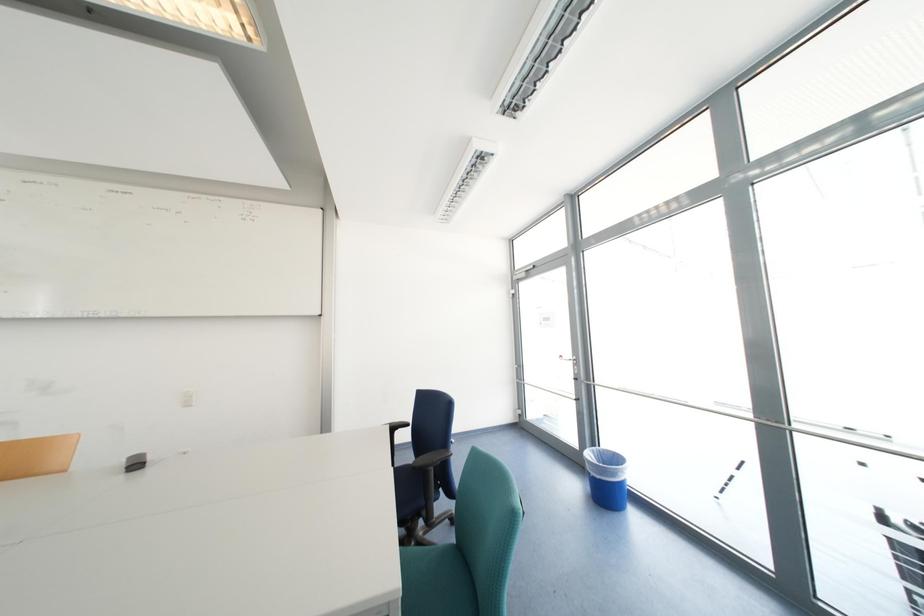
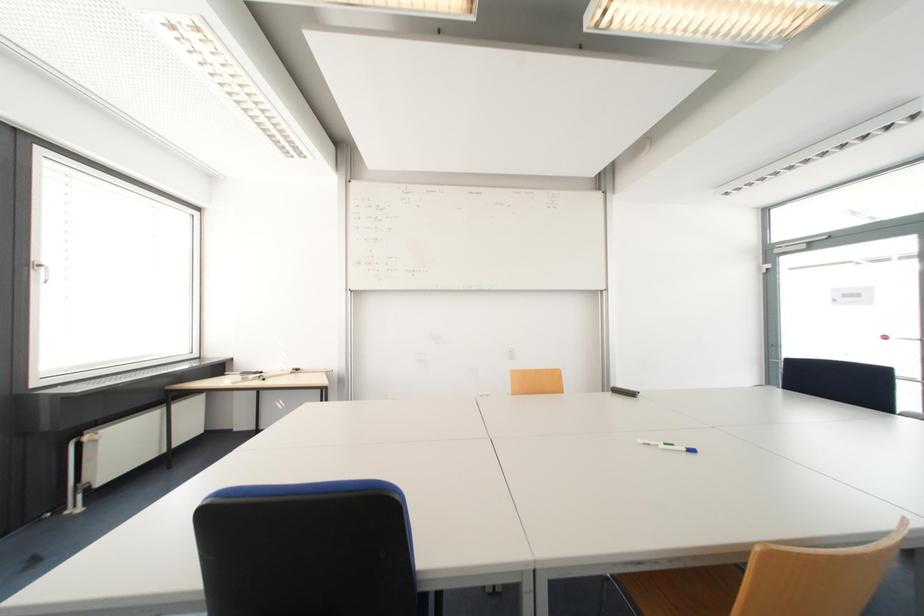
Question: What movement of the cameraman would produce the second image?

Choices:
 (A) Left
 (B) Right
 (C) Forward
 (D) Backward

Answer: (A)